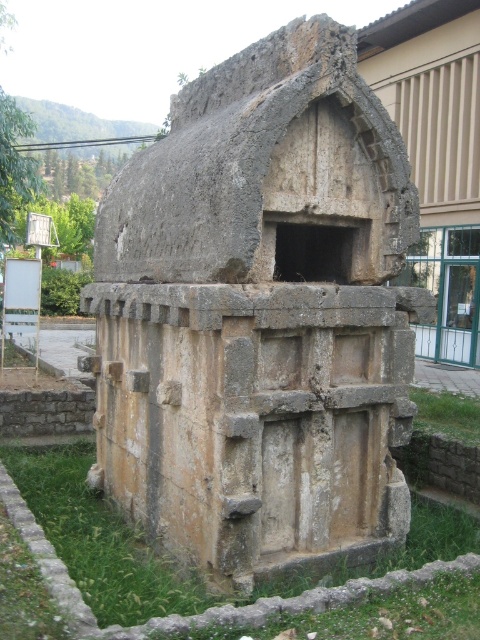
Is weathered stone tomb at center wider than rough stone tomb at center?

In fact, weathered stone tomb at center might be narrower than rough stone tomb at center.

Does weathered stone tomb at center have a smaller size compared to rough stone tomb at center?

Yes.

Which is in front, point (327, 246) or point (420, 257)?

Point (327, 246) is more forward.

Image resolution: width=480 pixels, height=640 pixels. What are the coordinates of `weathered stone tomb at center` in the screenshot? It's located at (260, 316).

What do you see at coordinates (97, 540) in the screenshot?
I see `green grass at lower center` at bounding box center [97, 540].

Who is lower down, green grass at lower center or rough stone tomb at center?

green grass at lower center is below.

Does point (31, 467) come farther from viewer compared to point (453, 44)?

No, (31, 467) is closer to viewer.

Locate an element on the screen. This screenshot has height=640, width=480. green grass at lower center is located at coordinates (97, 540).

Does point (252, 64) come farther from viewer compared to point (336, 628)?

That is True.

Does weathered stone tomb at center appear over green grass at lower center?

Correct, weathered stone tomb at center is located above green grass at lower center.

Does point (302, 240) come closer to viewer compared to point (115, 538)?

That is False.

At what (x,y) coordinates should I click in order to perform the action: click on weathered stone tomb at center. Please return your answer as a coordinate pair (x, y). Image resolution: width=480 pixels, height=640 pixels. Looking at the image, I should click on (260, 316).